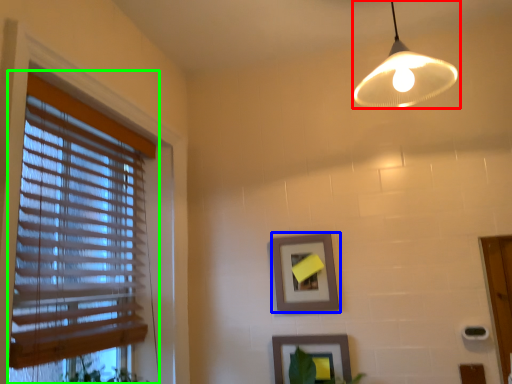
Question: Based on their relative distances, which object is nearer to lamp (highlighted by a red box)? Choose from picture frame (highlighted by a blue box) and window blind (highlighted by a green box).

Choices:
 (A) picture frame
 (B) window blind

Answer: (A)